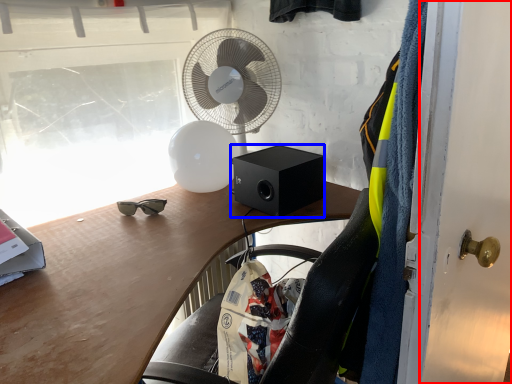
Question: Which point is further to the camera, door (highlighted by a red box) or loudspeaker (highlighted by a blue box)?

Choices:
 (A) door
 (B) loudspeaker

Answer: (B)